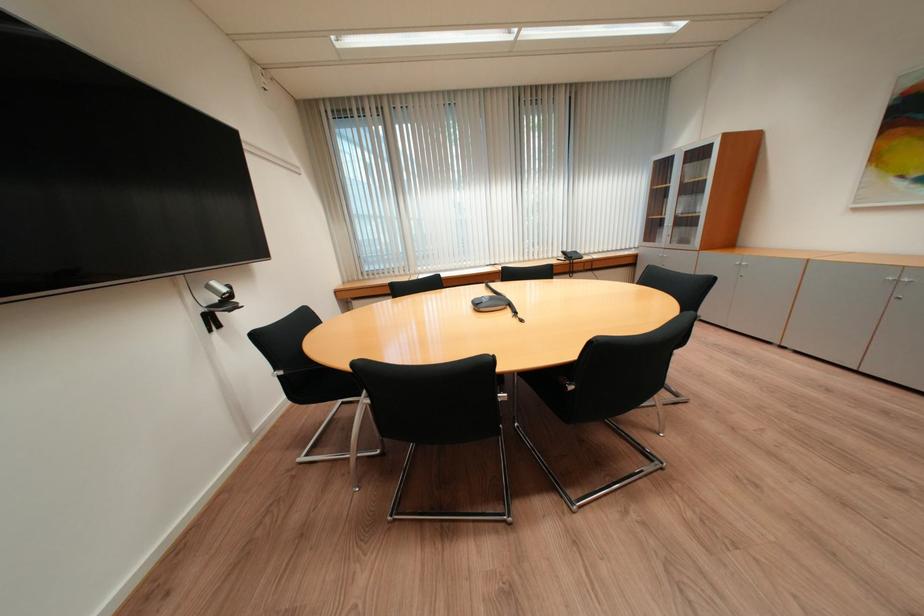
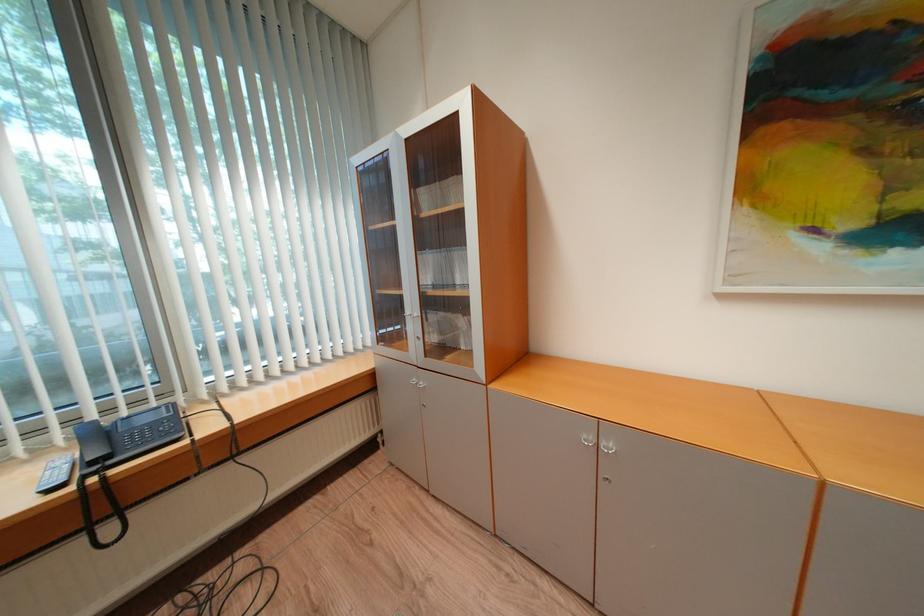
The point at (573, 254) is marked in the first image. Where is the corresponding point in the second image?

(104, 434)